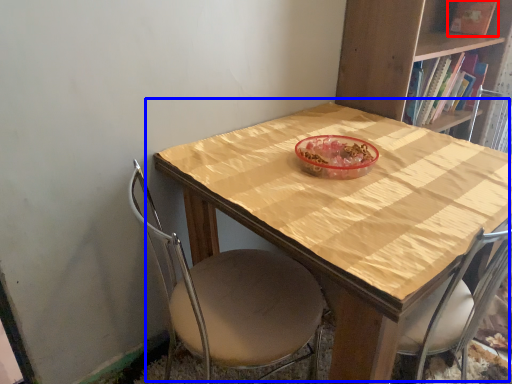
Question: Which point is further to the camera, book (highlighted by a red box) or table (highlighted by a blue box)?

Choices:
 (A) book
 (B) table

Answer: (A)